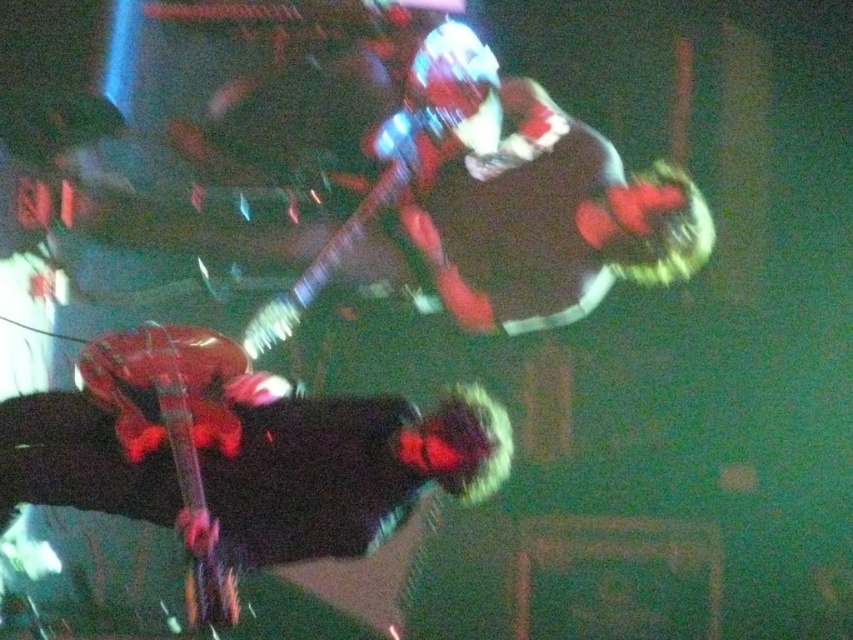
You are a photographer at the concert venue. You need to capture a clear photo of both the glossy red guitar at lower left and the glossy electric guitar at upper center. Which guitar should you focus on first to ensure it appears larger in the photo?

The glossy electric guitar at upper center is larger than the glossy red guitar at lower left, so focusing on it first will ensure it appears larger in the photo.

You are standing at the front of the stage where the concert is happening. You want to grab the shiny black guitar at lower left to hand it to the performer. Can you reach it without moving from your current position?

The shiny black guitar at lower left is 3.56 meters away from the camera, so if you are at the front of the stage, you might not be able to reach it without moving closer.

In the scene shown: You are standing at the back of the venue and see two points on the stage. The first point is labeled as point (114, 374) and the second is point (312, 268). Which point is closer to you?

Point (312, 268) is closer to you because it is behind point (114, 374), which is in front of it.